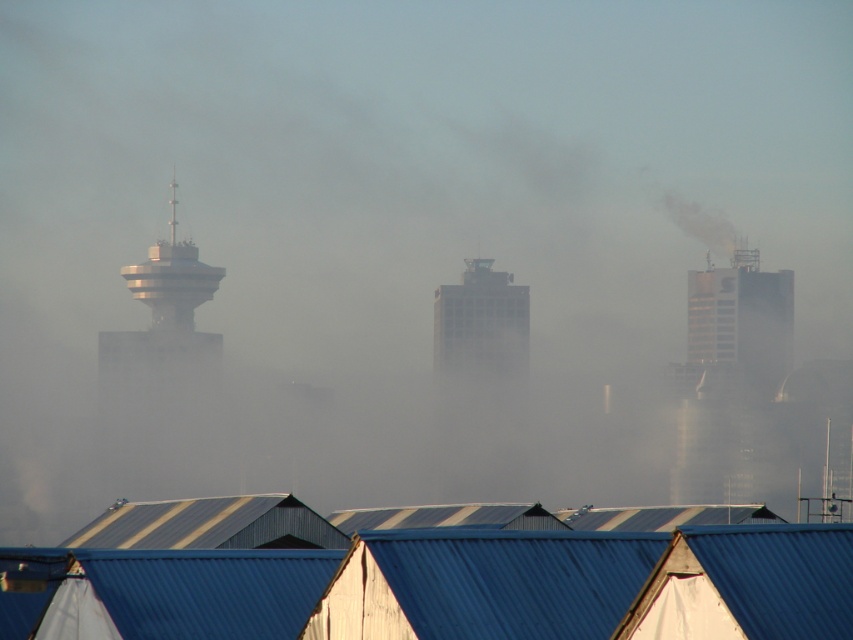
Question: Does blue corrugated metal at lower center appear under gray concrete building at center?

Choices:
 (A) yes
 (B) no

Answer: (A)

Question: Can you confirm if blue corrugated metal at lower center is wider than gray concrete building at center?

Choices:
 (A) no
 (B) yes

Answer: (B)

Question: Is blue corrugated metal at lower center to the left of gray concrete building at center from the viewer's perspective?

Choices:
 (A) yes
 (B) no

Answer: (A)